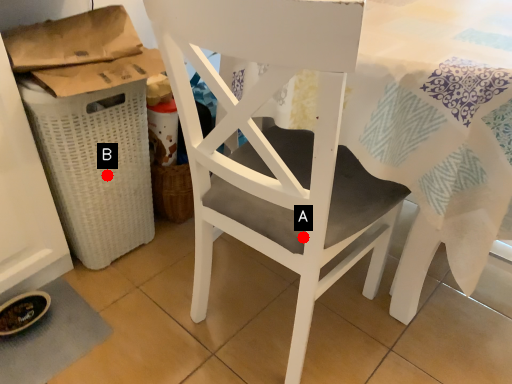
Question: Two points are circled on the image, labeled by A and B beside each circle. Which point is farther to the camera?

Choices:
 (A) A is further
 (B) B is further

Answer: (B)